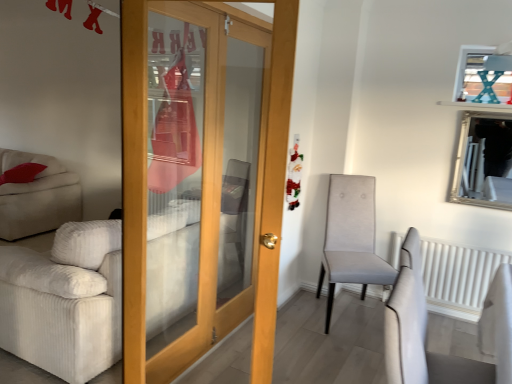
This screenshot has width=512, height=384. Find the location of `free point above white textured radiator at right (from a real-world perspective)`. free point above white textured radiator at right (from a real-world perspective) is located at coordinates (454, 241).